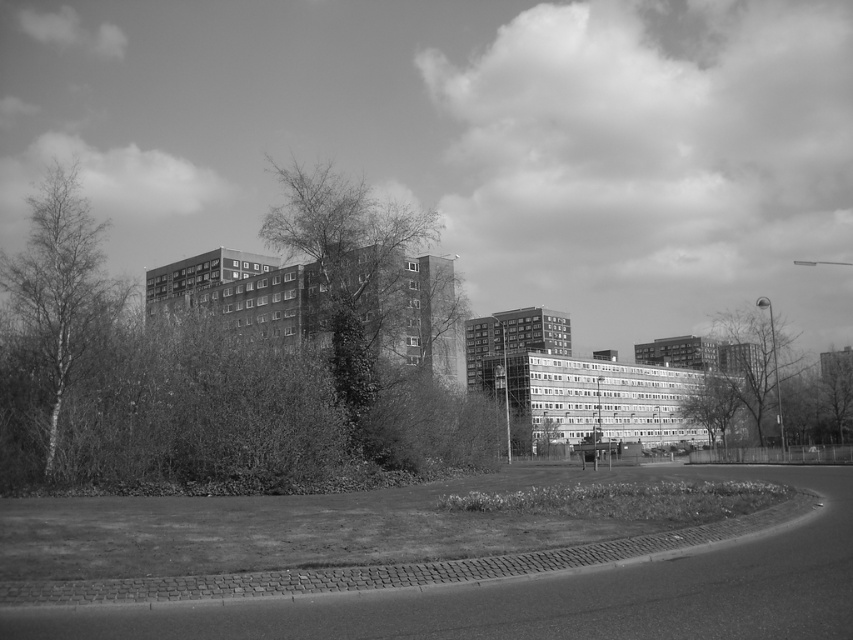
You are a landscape architect designing a new garden. You observe the thick textured foliage at center and the bare birch tree at left in the image. Which object is positioned lower in the scene?

The thick textured foliage at center is positioned lower than the bare birch tree at left according to the description.